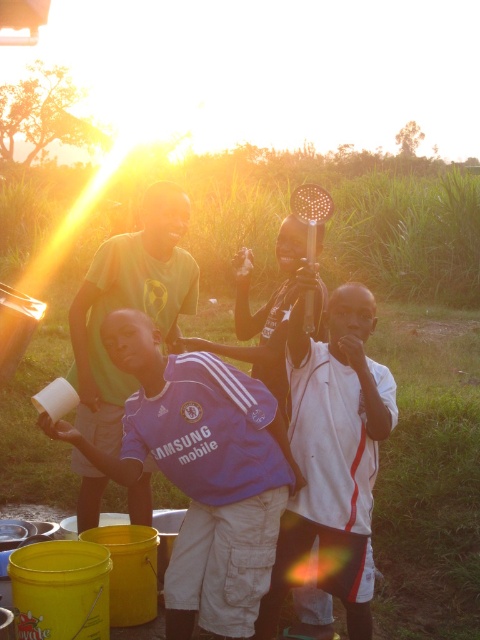
You are a photographer trying to capture the purple jersey at center in the golden sunlight. Based on the scene description, where should you position your camera to ensure the jersey is well lit by the sunlight?

The purple jersey at center is located at point (202, 472). Since the sun is low in the sky creating a lens flare, positioning the camera so the jersey is facing towards the direction of the sunlight would ensure it is well lit.